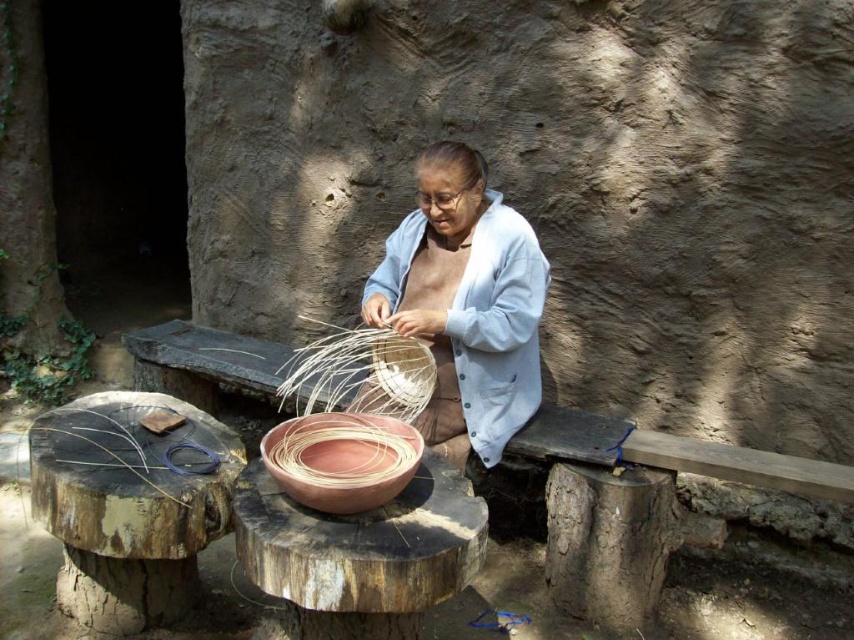
You are a visitor observing the elderly woman crafting. You notice the light blue fabric at center and the terracotta woven basket at center. Which object is closer to you?

The light blue fabric at center is closer to you because the terracotta woven basket at center is behind it.

You are standing in front of the shelter and want to place two markers on the ground. The first marker should be placed at point (492,241) and the second at (272,436). Which marker will be closer to you?

Point (492,241) is further to the viewer than point (272,436), so the first marker will be closer to you.

From the picture: You are a visitor standing in front of the shelter and see the light blue fabric at center and the terracotta woven basket at center. The shelter has a narrow doorway that is 25 inches wide. Can you walk through the doorway while carrying both items side by side?

The light blue fabric at center and terracotta woven basket at center are 24.98 inches apart from each other. Since the doorway is 25 inches wide, you can just barely fit both items side by side through the doorway.